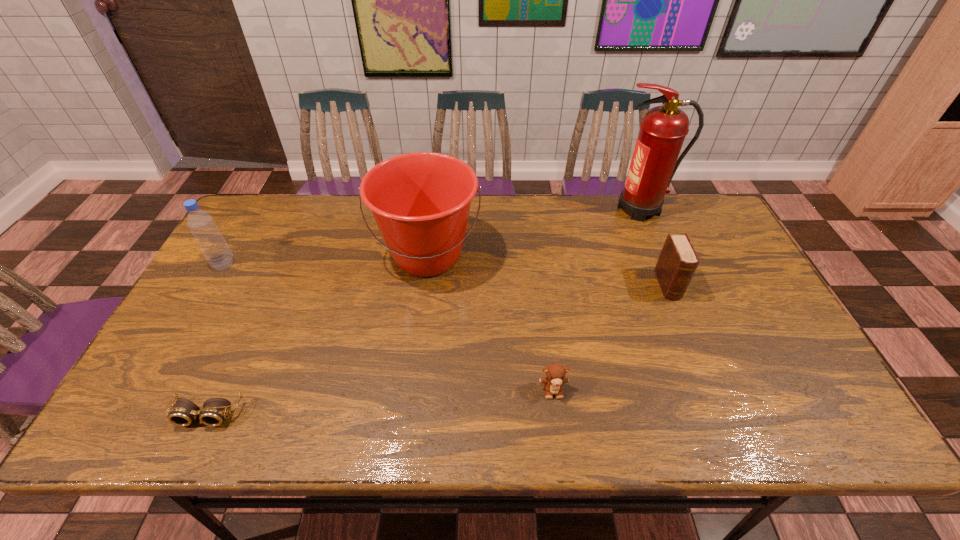
Find the location of a particular element. The width and height of the screenshot is (960, 540). vacant position located on the front-facing side of the tallest object is located at coordinates (537, 208).

Image resolution: width=960 pixels, height=540 pixels. I want to click on free spot located 0.220m on the front-facing side of the tallest object, so click(x=542, y=208).

Find the location of a particular element. The image size is (960, 540). free space located on the front-facing side of the tallest object is located at coordinates (560, 208).

Identify the location of free space located 0.330m with the handle attached to the rim of the fourth object from right to left. The image size is (960, 540). (410, 401).

This screenshot has width=960, height=540. I want to click on free space located 0.380m on the front of the bottle, so click(153, 388).

Identify the location of vacant position located on the spine side of the third shortest object. (691, 343).

Identify the location of vacant point located on the face of the third object from right to left. The height and width of the screenshot is (540, 960). (560, 438).

The image size is (960, 540). Identify the location of fire extinguisher that is at the far edge. (663, 129).

Locate an element on the screen. bucket that is at the far edge is located at coordinates (421, 201).

I want to click on object that is at the near edge, so click(183, 413).